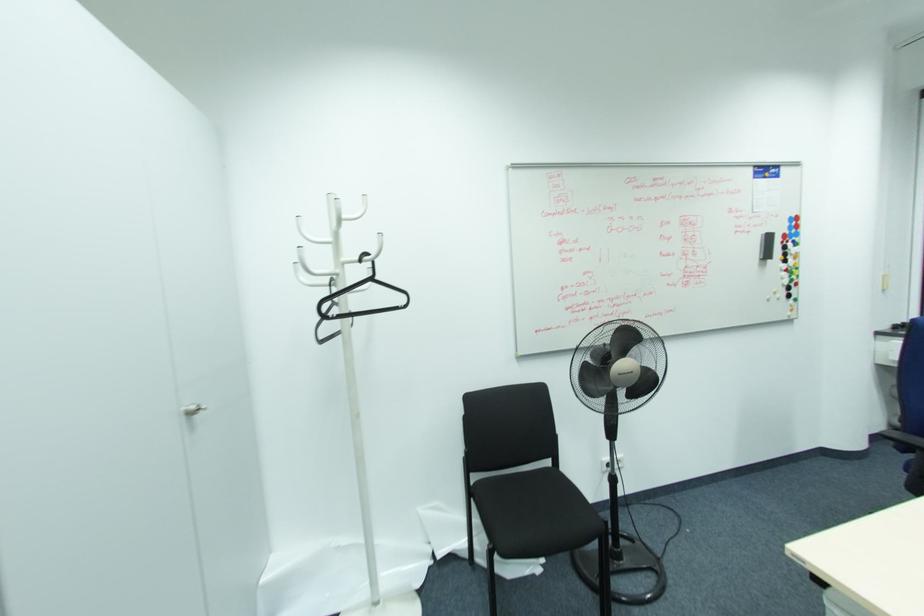
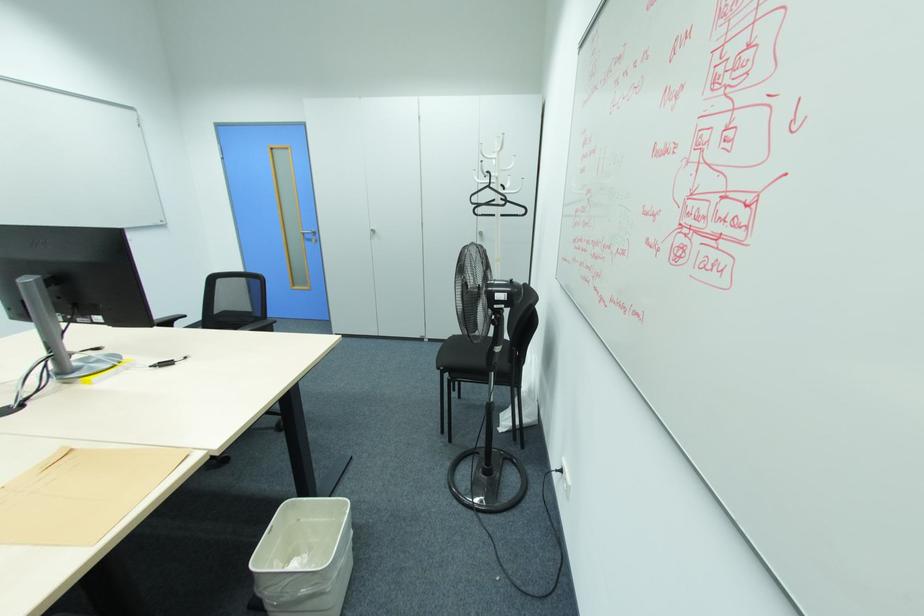
Where in the second image is the point corresponding to pixel 371 280 from the first image?

(490, 187)